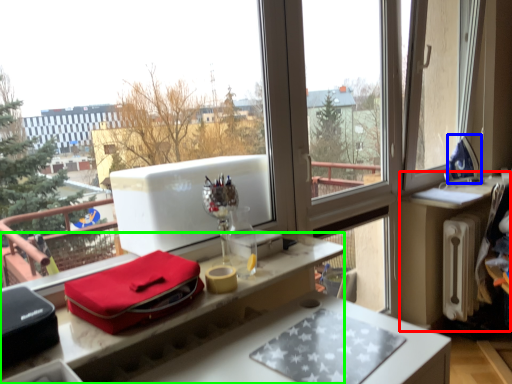
Question: Estimate the real-world distances between objects in this image. Which object is closer to table (highlighted by a red box), appliance (highlighted by a blue box) or desk (highlighted by a green box)?

Choices:
 (A) appliance
 (B) desk

Answer: (A)